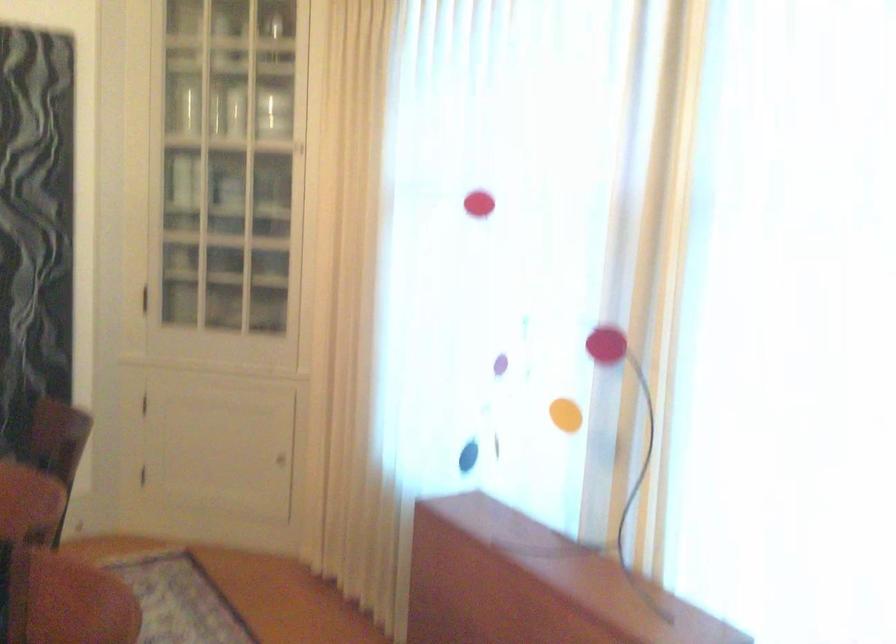
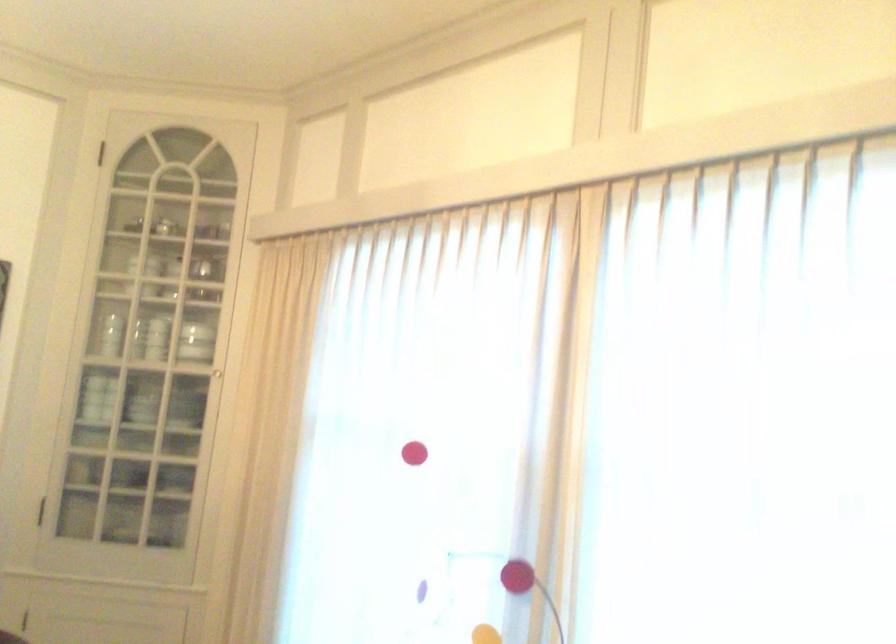
In a continuous first-person perspective shot, in which direction is the camera moving?

The cameraman moved toward left, backward.